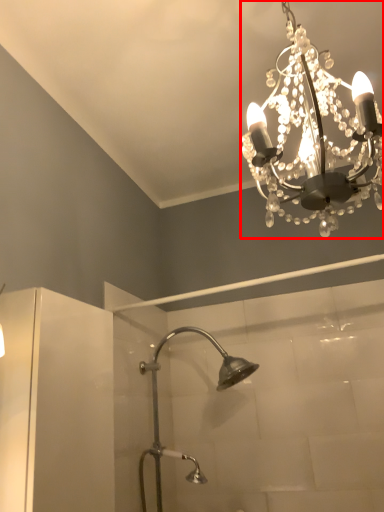
Question: From the image, what is the correct spatial relationship of lamp (annotated by the red box) in relation to shower?

Choices:
 (A) right
 (B) left

Answer: (A)